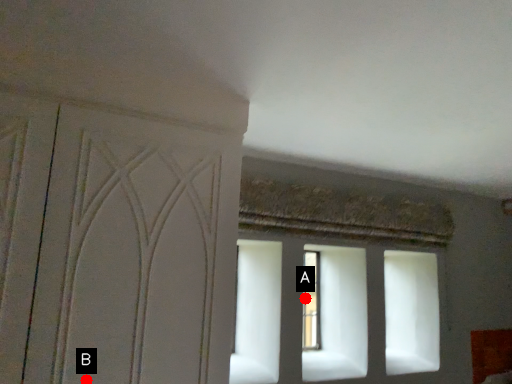
Question: Two points are circled on the image, labeled by A and B beside each circle. Which point is farther to the camera?

Choices:
 (A) A is further
 (B) B is further

Answer: (A)